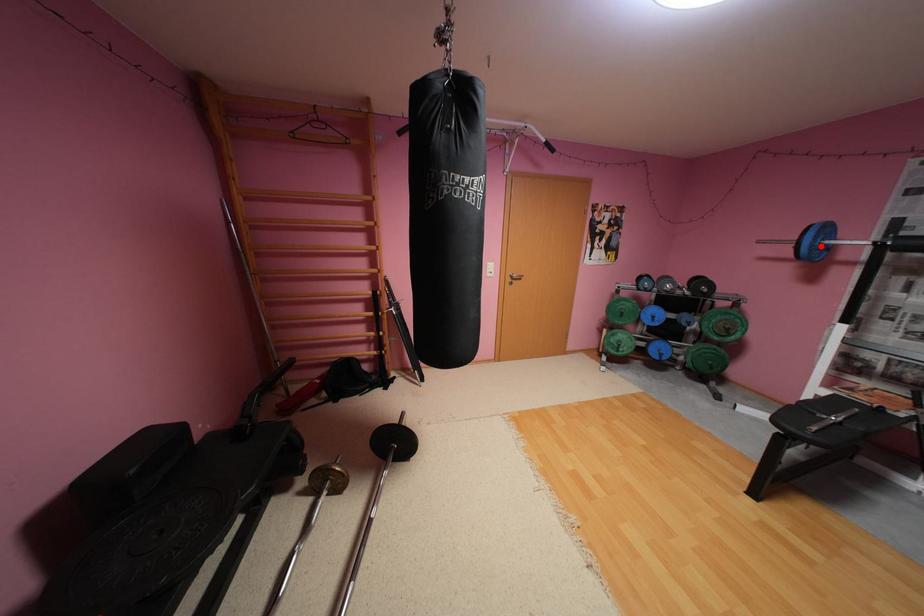
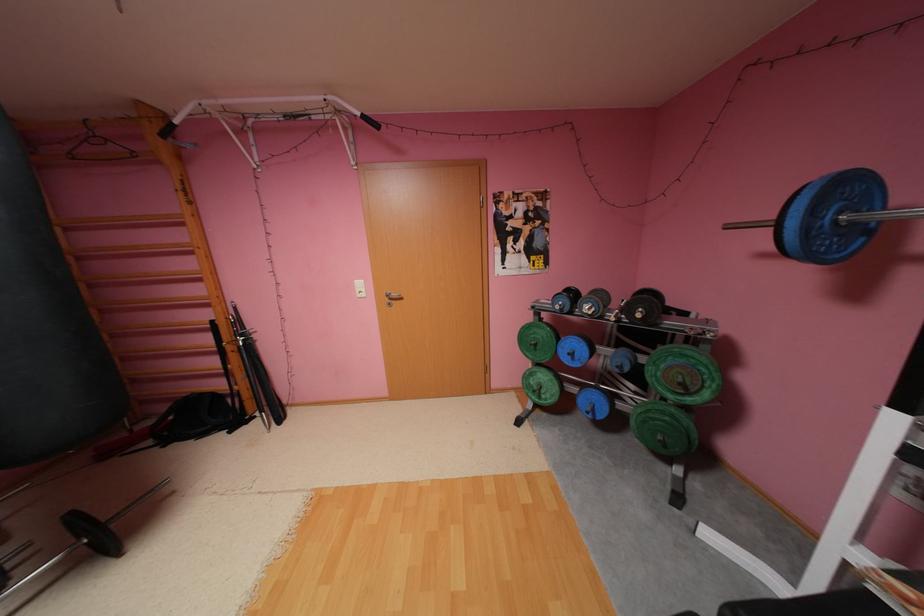
Find the pixel in the second image that matches the highlighted location in the first image.

(816, 229)